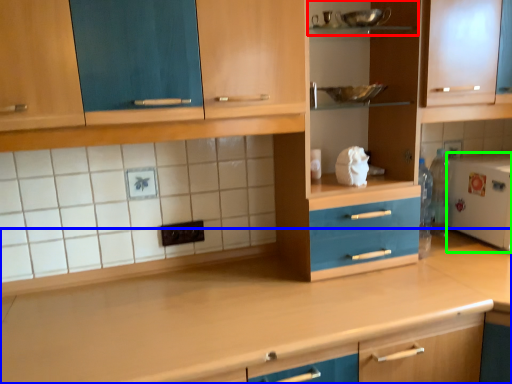
Question: Which object is the closest to the shelf (highlighted by a red box)? Choose among these: countertop (highlighted by a blue box) or appliance (highlighted by a green box).

Choices:
 (A) countertop
 (B) appliance

Answer: (B)